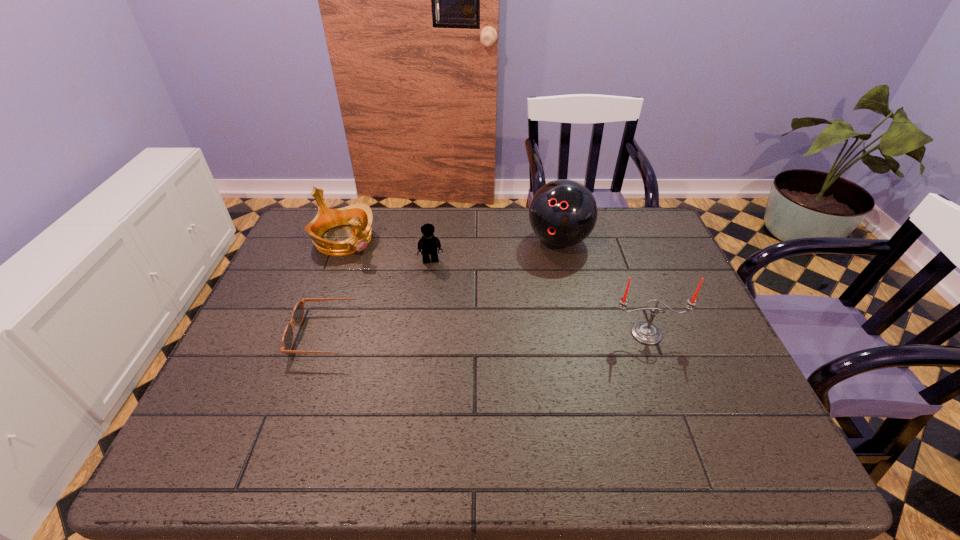
I want to click on tiara that is at the left edge, so click(359, 216).

Locate an element on the screen. object that is at the right edge is located at coordinates (646, 333).

The width and height of the screenshot is (960, 540). Find the location of `object positioned at the far left corner`. object positioned at the far left corner is located at coordinates (359, 216).

At what (x,y) coordinates should I click in order to perform the action: click on free region at the far edge. Please return your answer as a coordinate pair (x, y). Looking at the image, I should click on (441, 217).

In the image, there is a desktop. Identify the location of free space at the near edge. (538, 417).

Identify the location of vacant area at the right edge. (723, 342).

Identify the location of vacant area at the near left corner of the desktop. The image size is (960, 540). (267, 407).

I want to click on free space at the far right corner of the desktop, so click(637, 240).

The image size is (960, 540). What are the coordinates of `vacant point located between the tiara and the Lego` in the screenshot? It's located at (388, 250).

I want to click on free space between the tiara and the shortest object, so click(338, 287).